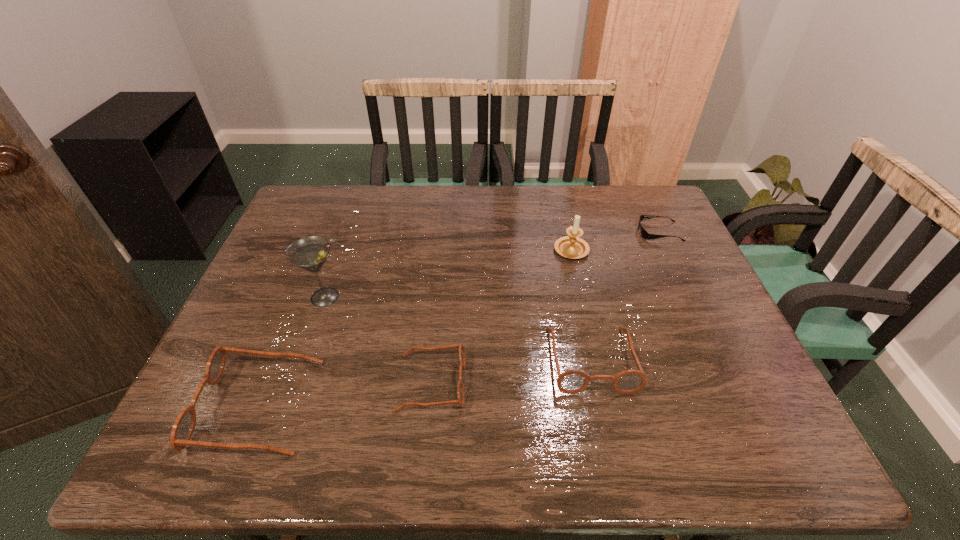
In the image, there is a desktop. Where is `free space at the near right corner`? The width and height of the screenshot is (960, 540). free space at the near right corner is located at coordinates (753, 408).

You are a GUI agent. You are given a task and a screenshot of the screen. Output one action in this format:
    pyautogui.click(x=<x>, y=<y>)
    Task: Click on the vacant space that's between the sunglasses and the fourth object from right to left
    This screenshot has width=960, height=540.
    Given the screenshot: What is the action you would take?
    tap(545, 307)

This screenshot has width=960, height=540. Find the location of `free spot between the second spectacles from left to right and the fourth nearest object`. free spot between the second spectacles from left to right and the fourth nearest object is located at coordinates point(378,340).

In order to click on vacant space that is in between the second tallest object and the fifth tallest object in this screenshot , I will do `click(501, 315)`.

Image resolution: width=960 pixels, height=540 pixels. What are the coordinates of `free space between the leftmost spectacles and the tallest object` in the screenshot? It's located at (292, 352).

At what (x,y) coordinates should I click in order to perform the action: click on vacant area that lies between the shortest spectacles and the martini. Please return your answer as a coordinate pair (x, y). This screenshot has height=540, width=960. Looking at the image, I should click on (378, 340).

Find the location of a particular element. This screenshot has height=540, width=960. empty location between the rightmost spectacles and the fourth object from right to left is located at coordinates (512, 371).

Image resolution: width=960 pixels, height=540 pixels. I want to click on free space between the martini and the second spectacles from left to right, so click(x=378, y=340).

At what (x,y) coordinates should I click in order to perform the action: click on vacant space that's between the second tallest spectacles and the third tallest object. Please return your answer as a coordinate pair (x, y). Image resolution: width=960 pixels, height=540 pixels. Looking at the image, I should click on pos(424,383).

Find the location of `empty location between the tallest spectacles and the sunglasses`. empty location between the tallest spectacles and the sunglasses is located at coordinates (459, 319).